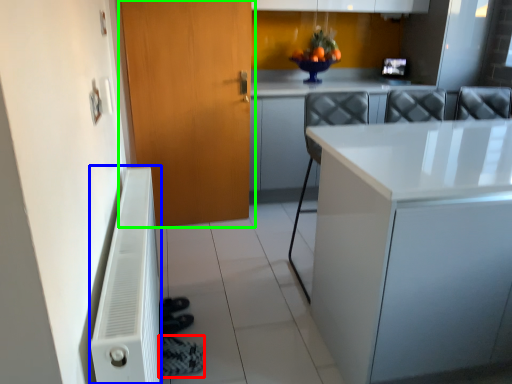
Question: Estimate the real-world distances between objects in this image. Which object is closer to shoe (highlighted by a red box), radiator (highlighted by a blue box) or door (highlighted by a green box)?

Choices:
 (A) radiator
 (B) door

Answer: (A)